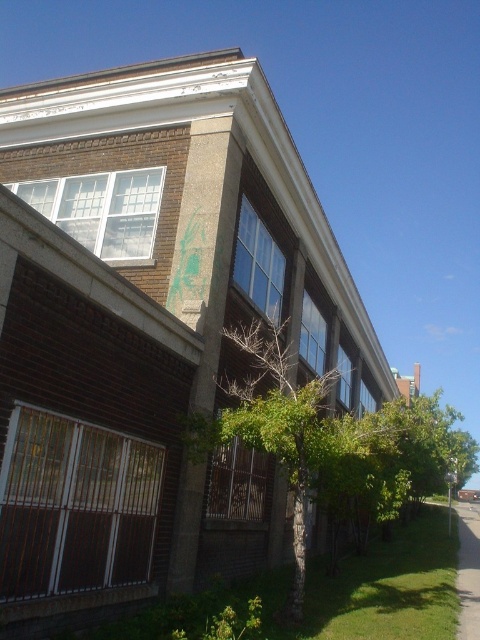
Is point (291, 593) closer to viewer compared to point (469, 632)?

Yes.

Where is `green leafy tree at center`? green leafy tree at center is located at coordinates (333, 445).

Identify the location of green leafy tree at center. (333, 445).